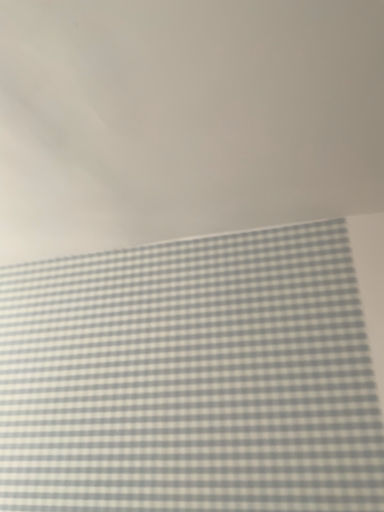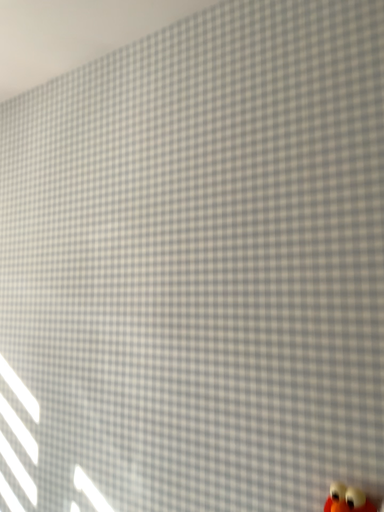
Question: Which way did the camera rotate in the video?

Choices:
 (A) rotated downward
 (B) rotated upward

Answer: (A)